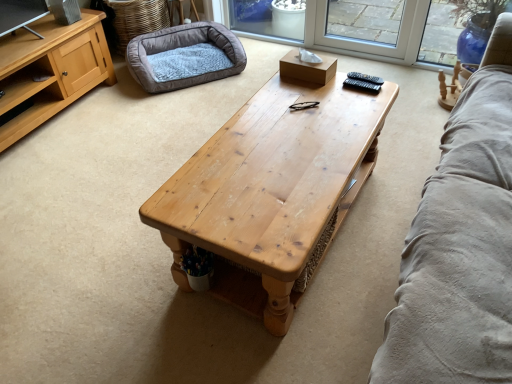
Question: Does wooden coffee table at center appear on the right side of soft gray plush dog bed at upper left?

Choices:
 (A) yes
 (B) no

Answer: (A)

Question: Does wooden coffee table at center come behind soft gray plush dog bed at upper left?

Choices:
 (A) yes
 (B) no

Answer: (B)

Question: From a real-world perspective, is wooden coffee table at center beneath soft gray plush dog bed at upper left?

Choices:
 (A) yes
 (B) no

Answer: (B)

Question: Considering the relative sizes of wooden coffee table at center and soft gray plush dog bed at upper left in the image provided, is wooden coffee table at center wider than soft gray plush dog bed at upper left?

Choices:
 (A) yes
 (B) no

Answer: (A)

Question: Is wooden coffee table at center completely or partially outside of soft gray plush dog bed at upper left?

Choices:
 (A) no
 (B) yes

Answer: (B)

Question: From a real-world perspective, is wooden coffee table at center over soft gray plush dog bed at upper left?

Choices:
 (A) no
 (B) yes

Answer: (B)

Question: From a real-world perspective, does soft gray plush dog bed at upper left sit lower than wooden coffee table at center?

Choices:
 (A) yes
 (B) no

Answer: (A)

Question: Is soft gray plush dog bed at upper left aimed at wooden coffee table at center?

Choices:
 (A) no
 (B) yes

Answer: (B)

Question: Is soft gray plush dog bed at upper left oriented away from wooden coffee table at center?

Choices:
 (A) no
 (B) yes

Answer: (A)

Question: Does soft gray plush dog bed at upper left appear on the left side of wooden coffee table at center?

Choices:
 (A) yes
 (B) no

Answer: (A)

Question: Considering the relative positions of soft gray plush dog bed at upper left and wooden coffee table at center in the image provided, is soft gray plush dog bed at upper left to the right of wooden coffee table at center from the viewer's perspective?

Choices:
 (A) yes
 (B) no

Answer: (B)

Question: Is soft gray plush dog bed at upper left positioned beyond the bounds of wooden coffee table at center?

Choices:
 (A) yes
 (B) no

Answer: (A)

Question: Considering the positions of soft gray plush dog bed at upper left and wooden coffee table at center in the image, is soft gray plush dog bed at upper left wider or thinner than wooden coffee table at center?

Choices:
 (A) thin
 (B) wide

Answer: (A)